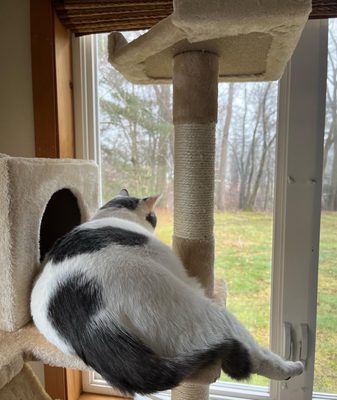
I want to click on plant, so click(x=137, y=184).